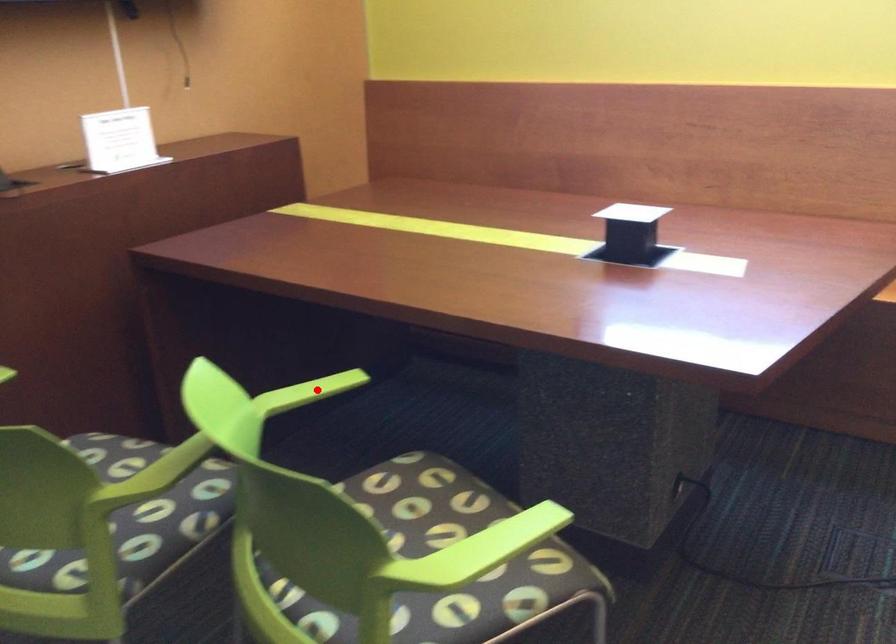
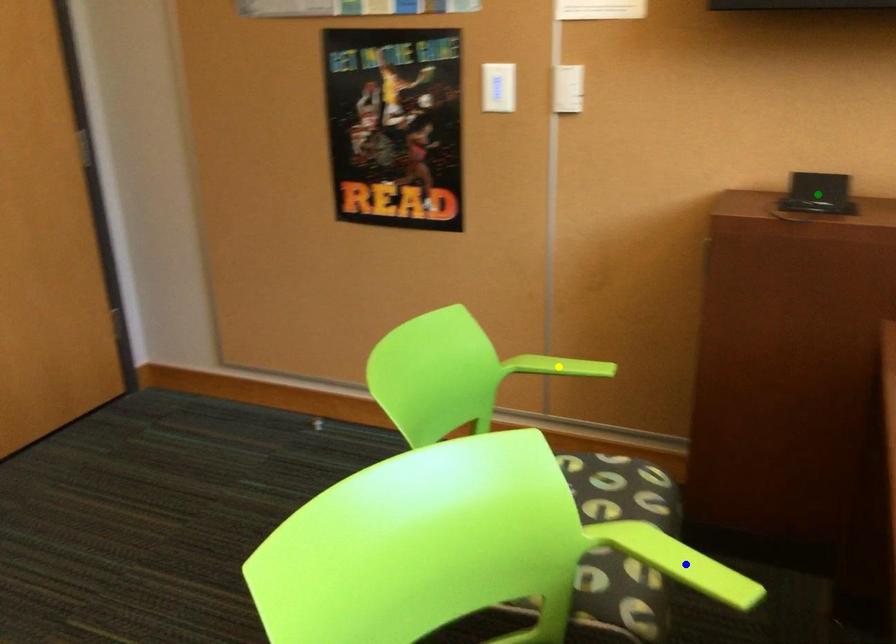
Question: I am providing you with two images of the same scene from different viewpoints. A red point is marked on the first image. You are given multiple points on the second image. Which spot in image 2 lines up with the point in image 1?

Choices:
 (A) blue point
 (B) green point
 (C) yellow point

Answer: (A)